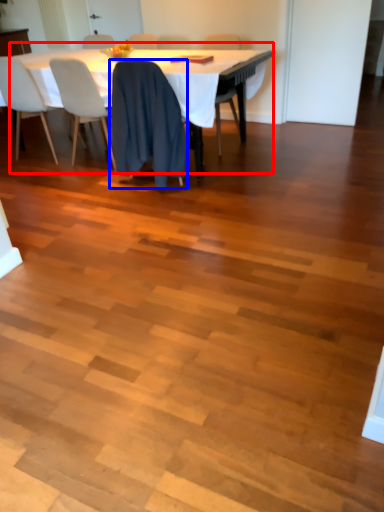
Question: Among these objects, which one is nearest to the camera, table (highlighted by a red box) or chair (highlighted by a blue box)?

Choices:
 (A) table
 (B) chair

Answer: (B)